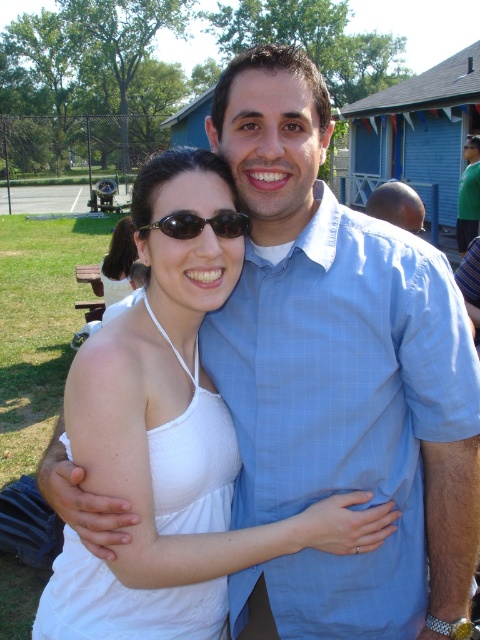
Does smooth bald head at center have a larger size compared to white fabric top at center?

Correct, smooth bald head at center is larger in size than white fabric top at center.

Does smooth bald head at center appear over white fabric top at center?

No.

What are the coordinates of `smooth bald head at center` in the screenshot? It's located at (396, 205).

Can you confirm if smooth bald head at center is positioned below black plastic goggles at upper center?

No.

Does smooth bald head at center have a lesser height compared to black plastic goggles at upper center?

In fact, smooth bald head at center may be taller than black plastic goggles at upper center.

You are a GUI agent. You are given a task and a screenshot of the screen. Output one action in this format:
    pyautogui.click(x=<x>, y=<y>)
    Task: Click on the smooth bald head at center
    Image resolution: width=480 pixels, height=640 pixels.
    Given the screenshot: What is the action you would take?
    pyautogui.click(x=396, y=205)

Between point (139, 232) and point (468, 241), which one is positioned behind?

Point (468, 241)

This screenshot has width=480, height=640. What do you see at coordinates (201, 225) in the screenshot?
I see `black plastic goggles at upper center` at bounding box center [201, 225].

At what (x,y) coordinates should I click in order to perform the action: click on black plastic goggles at upper center. Please return your answer as a coordinate pair (x, y). Looking at the image, I should click on (201, 225).